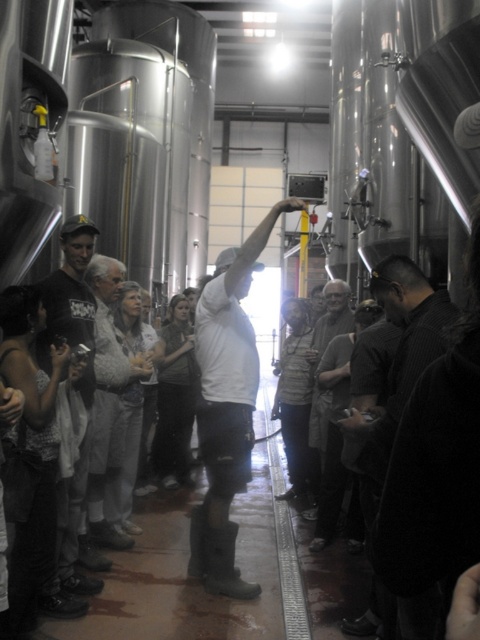
Question: Does white matte shirt at center appear under dark gray shirt at center?

Choices:
 (A) no
 (B) yes

Answer: (A)

Question: Can you confirm if dark gray shirt at center is positioned below light gray fabric jacket at center?

Choices:
 (A) no
 (B) yes

Answer: (A)

Question: Estimate the real-world distances between objects in this image. Which object is farther from the dark gray shirt at center?

Choices:
 (A) light gray fabric jacket at center
 (B) dark textured shirt at center
 (C) white matte shirt at center
 (D) gray knit sweater at center

Answer: (D)

Question: Can you confirm if white matte shirt at center is thinner than dark textured shirt at center?

Choices:
 (A) yes
 (B) no

Answer: (B)

Question: Considering the real-world distances, which object is farthest from the dark textured shirt at center?

Choices:
 (A) light gray fabric jacket at center
 (B) white matte shirt at center

Answer: (A)

Question: Which point appears farthest from the camera in this image?

Choices:
 (A) (78, 234)
 (B) (146, 374)
 (C) (338, 308)

Answer: (C)